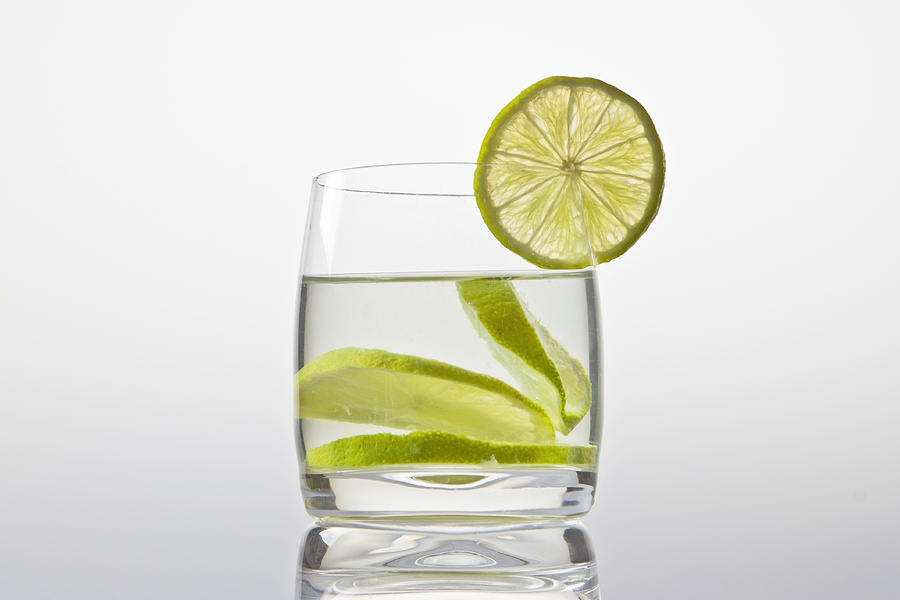
Where is `water in glass`? water in glass is located at coordinates (424, 301).